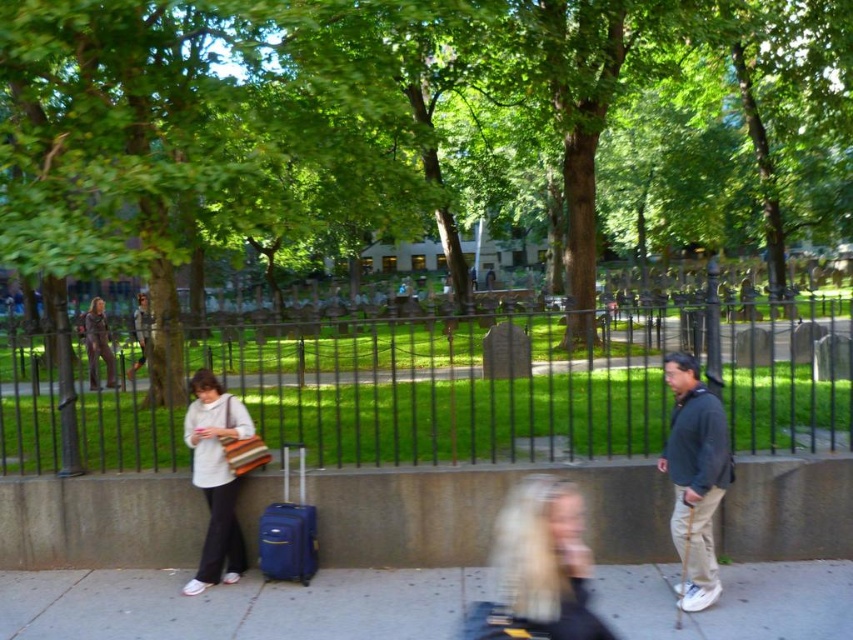
Question: Among these points, which one is farthest from the camera?

Choices:
 (A) (105, 353)
 (B) (279, 525)
 (C) (218, 381)

Answer: (A)

Question: Where is blonde hair at center located in relation to dark gray sweater at right in the image?

Choices:
 (A) left
 (B) right

Answer: (A)

Question: Estimate the real-world distances between objects in this image. Which object is farther from the matte brown pants at center?

Choices:
 (A) smooth concrete sidewalk at center
 (B) matte brown jumpsuit at center

Answer: (A)

Question: Considering the real-world distances, which object is closest to the matte brown jumpsuit at center?

Choices:
 (A) smooth concrete sidewalk at center
 (B) blue hardshell suitcase at center

Answer: (B)

Question: Is matte brown pants at center thinner than matte brown jumpsuit at center?

Choices:
 (A) no
 (B) yes

Answer: (A)

Question: Is smooth concrete sidewalk at center thinner than striped fabric bag at center?

Choices:
 (A) no
 (B) yes

Answer: (A)